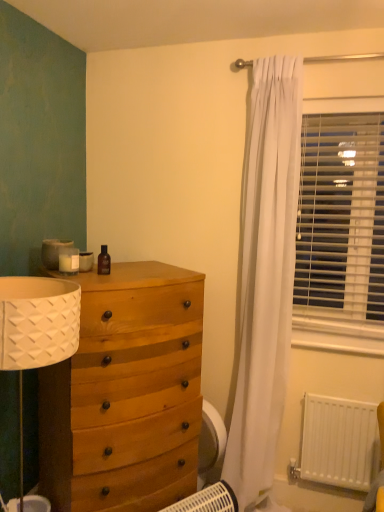
Where is `free space in front of brown glass bottle at upper center`? free space in front of brown glass bottle at upper center is located at coordinates (95, 283).